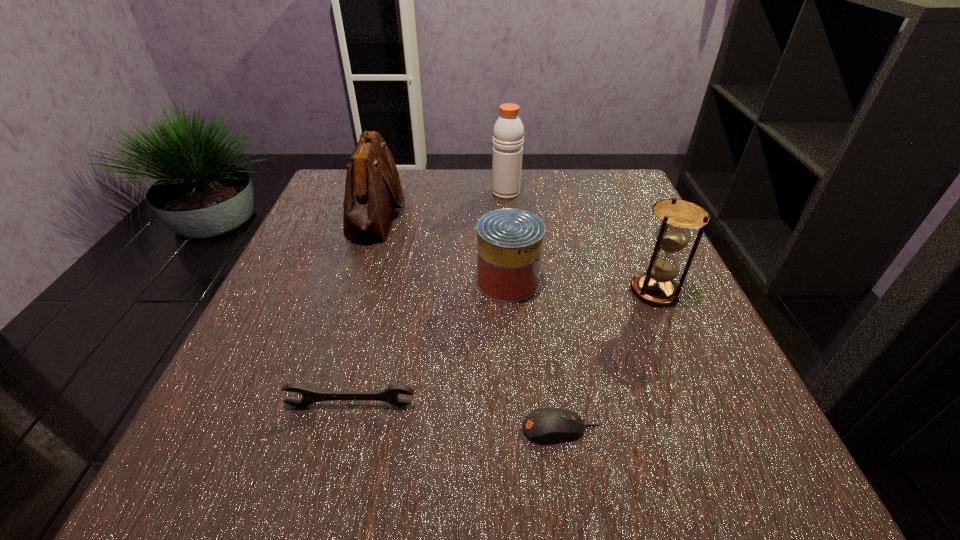
Locate an element on the screen. The width and height of the screenshot is (960, 540). vacant position in the image that satisfies the following two spatial constraints: 1. on the front side of the shortest object; 2. on the left side of the shaker is located at coordinates (526, 429).

Where is `vacant space that satisfies the following two spatial constraints: 1. on the front side of the computer mouse; 2. on the right side of the shaker`? vacant space that satisfies the following two spatial constraints: 1. on the front side of the computer mouse; 2. on the right side of the shaker is located at coordinates (526, 429).

I want to click on free space that satisfies the following two spatial constraints: 1. on the open ends of the fifth tallest object; 2. on the left side of the computer mouse, so click(x=345, y=429).

At what (x,y) coordinates should I click in order to perform the action: click on free space in the image that satisfies the following two spatial constraints: 1. on the open ends of the nearest object; 2. on the right side of the second nearest object. Please return your answer as a coordinate pair (x, y). Looking at the image, I should click on (345, 429).